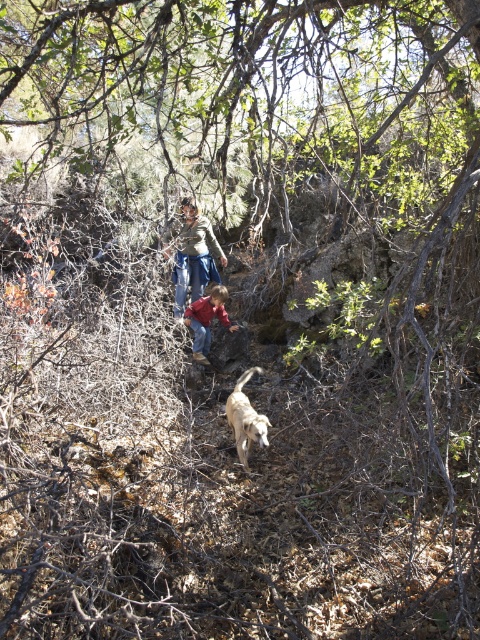
What do you see at coordinates (192, 253) in the screenshot? I see `denim skirt at center` at bounding box center [192, 253].

Who is positioned more to the right, denim skirt at center or red cotton shirt at center?

red cotton shirt at center is more to the right.

Identify the location of denim skirt at center. (192, 253).

Is point (243, 372) closer to viewer compared to point (224, 298)?

That is True.

Between point (242, 378) and point (218, 300), which one is positioned in front?

Point (242, 378) is in front.

Identify the location of golden fur dog at center. click(245, 419).

Does denim skirt at center have a greater width compared to golden fur dog at center?

Indeed, denim skirt at center has a greater width compared to golden fur dog at center.

Does denim skirt at center have a lesser width compared to golden fur dog at center?

No.

Is point (212, 259) closer to camera compared to point (245, 420)?

That is False.

Where is `denim skirt at center`? denim skirt at center is located at coordinates (192, 253).